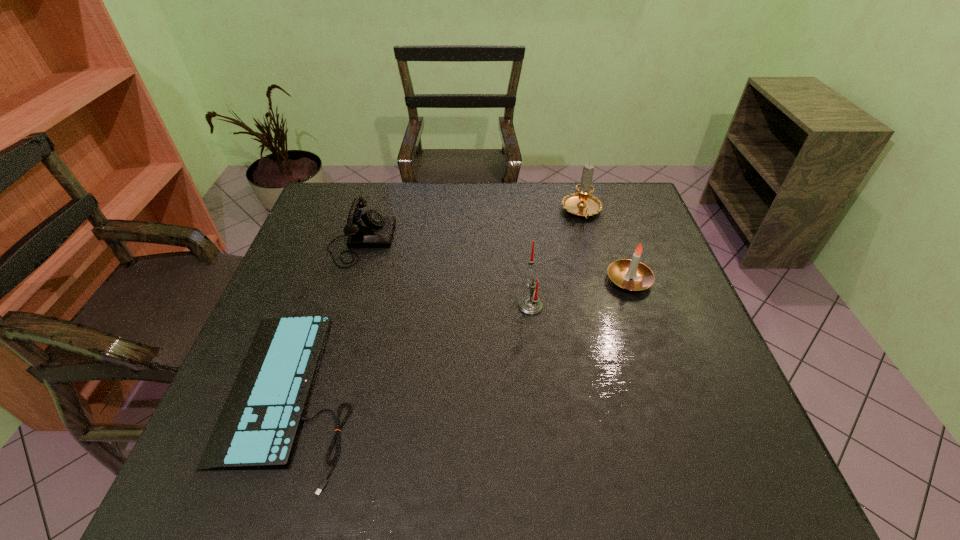
The width and height of the screenshot is (960, 540). Identify the location of the farthest candle. (582, 204).

Where is `the leftmost candle`? The width and height of the screenshot is (960, 540). the leftmost candle is located at coordinates (x=531, y=305).

Find the location of a particular element. The height and width of the screenshot is (540, 960). the third shortest object is located at coordinates (621, 272).

Locate an element on the screen. Image resolution: width=960 pixels, height=540 pixels. the fourth tallest object is located at coordinates (369, 229).

In order to click on computer keyboard in this screenshot , I will do `click(258, 427)`.

Image resolution: width=960 pixels, height=540 pixels. I want to click on free space located 0.400m on the left of the farthest candle, so click(436, 212).

The width and height of the screenshot is (960, 540). Find the location of `free space located 0.270m on the front-facing side of the leftmost candle`. free space located 0.270m on the front-facing side of the leftmost candle is located at coordinates click(x=411, y=306).

The height and width of the screenshot is (540, 960). I want to click on free spot located on the front-facing side of the leftmost candle, so click(398, 306).

Where is `vacant region located on the front-facing side of the leftmost candle`? vacant region located on the front-facing side of the leftmost candle is located at coordinates (422, 306).

Identify the location of blank area located 0.160m on the left of the shortest candle. (546, 280).